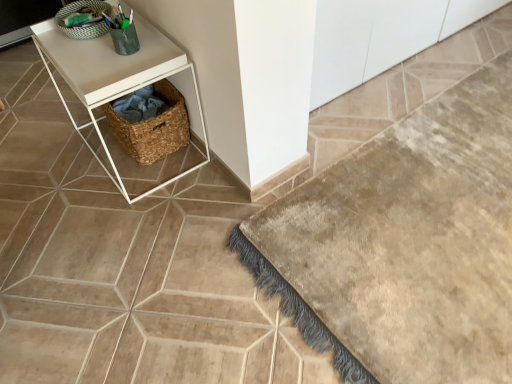
Question: Is white matte cabinet at upper center touching woven basket at lower left?

Choices:
 (A) no
 (B) yes

Answer: (A)

Question: Is white matte cabinet at upper center closer to the viewer compared to woven basket at lower left?

Choices:
 (A) no
 (B) yes

Answer: (B)

Question: Is white matte cabinet at upper center smaller than woven basket at lower left?

Choices:
 (A) no
 (B) yes

Answer: (A)

Question: Would you say woven basket at lower left is part of white matte cabinet at upper center's contents?

Choices:
 (A) yes
 (B) no

Answer: (B)

Question: Does white matte cabinet at upper center appear on the right side of woven basket at lower left?

Choices:
 (A) no
 (B) yes

Answer: (B)

Question: Can you confirm if white matte cabinet at upper center is shorter than woven basket at lower left?

Choices:
 (A) no
 (B) yes

Answer: (A)

Question: Can you confirm if woven brown basket at center, which is counted as the 1th basket, starting from the bottom, is smaller than white matte cabinet at upper center?

Choices:
 (A) yes
 (B) no

Answer: (A)

Question: Is woven brown basket at center, which is counted as the 1th basket, starting from the bottom, located outside white matte cabinet at upper center?

Choices:
 (A) no
 (B) yes

Answer: (B)

Question: Are woven brown basket at center, the second basket viewed from the top, and white matte cabinet at upper center beside each other?

Choices:
 (A) no
 (B) yes

Answer: (A)

Question: Is woven brown basket at center, the second basket viewed from the top, thinner than white matte cabinet at upper center?

Choices:
 (A) yes
 (B) no

Answer: (A)

Question: Is woven brown basket at center, which is counted as the 1th basket, starting from the bottom, further to the viewer compared to white matte cabinet at upper center?

Choices:
 (A) yes
 (B) no

Answer: (A)

Question: From a real-world perspective, does woven brown basket at center, the second basket viewed from the top, stand above white matte cabinet at upper center?

Choices:
 (A) no
 (B) yes

Answer: (A)

Question: From the image's perspective, would you say green woven basket at upper left, positioned as the 1th basket in top-to-bottom order, is positioned over woven brown basket at center, which is counted as the 1th basket, starting from the bottom?

Choices:
 (A) yes
 (B) no

Answer: (A)